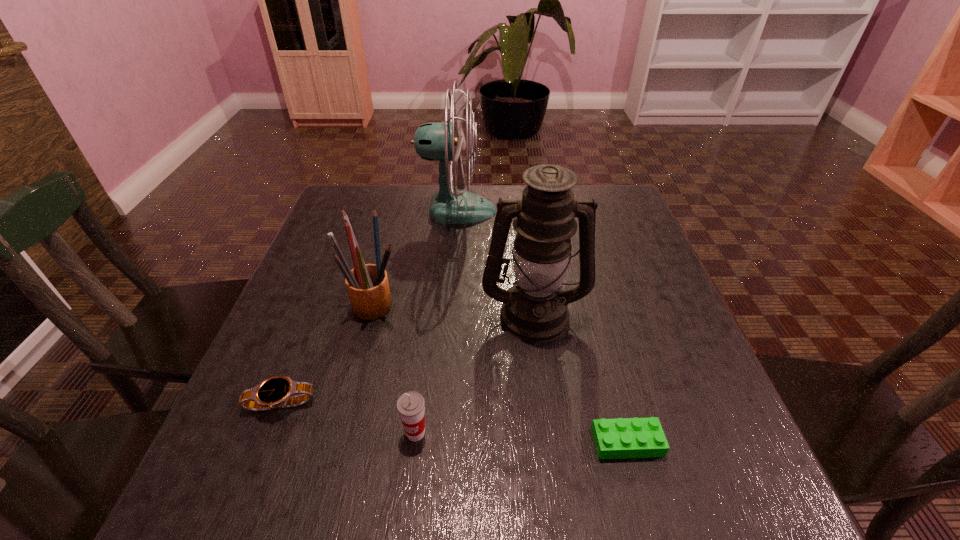
The image size is (960, 540). In the image, there is a desktop. Identify the location of vacant space at the far left corner. (374, 195).

In the image, there is a desktop. Identify the location of free space at the far right corner. (629, 225).

Where is `free space between the Lego and the watch`? This screenshot has height=540, width=960. free space between the Lego and the watch is located at coordinates pos(454,423).

The image size is (960, 540). I want to click on vacant region between the Lego and the pencil box, so click(501, 373).

You are a GUI agent. You are given a task and a screenshot of the screen. Output one action in this format:
    pyautogui.click(x=<x>, y=<y>)
    Task: Click on the vacant space that is in between the Lego and the oil lamp
    The height and width of the screenshot is (540, 960).
    Given the screenshot: What is the action you would take?
    pyautogui.click(x=581, y=378)

Find the location of a particular element. free point between the Lego and the oil lamp is located at coordinates (581, 378).

The image size is (960, 540). What are the coordinates of `unoccupied area between the cup and the oil lamp` in the screenshot? It's located at (475, 373).

Locate an element on the screen. The height and width of the screenshot is (540, 960). unoccupied position between the cup and the oil lamp is located at coordinates (475, 373).

This screenshot has height=540, width=960. In order to click on vacant space that's between the cup and the Lego in this screenshot , I will do `click(521, 438)`.

You are a GUI agent. You are given a task and a screenshot of the screen. Output one action in this format:
    pyautogui.click(x=<x>, y=<y>)
    Task: Click on the free space between the pencil box and the watch
    The image size is (960, 540).
    Given the screenshot: What is the action you would take?
    pyautogui.click(x=328, y=355)